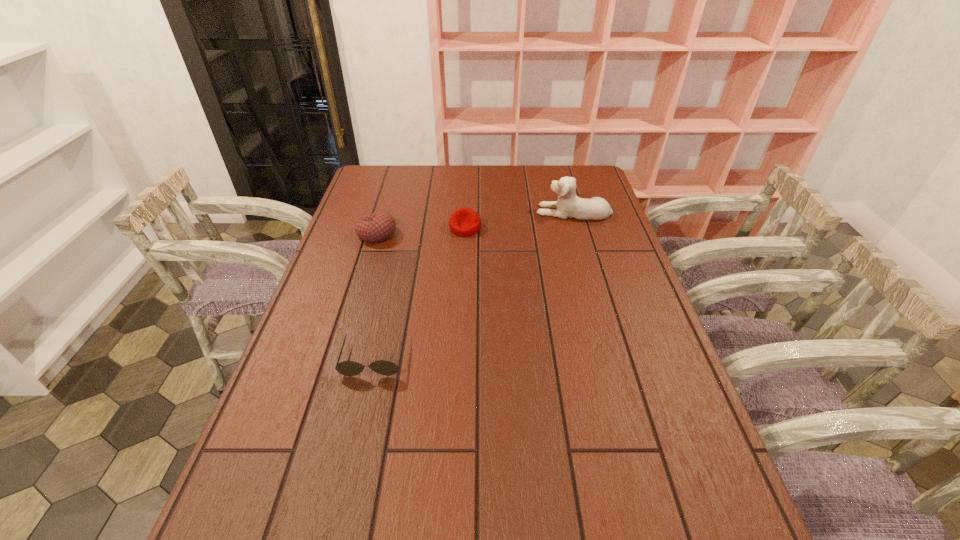
This screenshot has height=540, width=960. I want to click on free space at the far right corner of the desktop, so click(584, 168).

At what (x,y) coordinates should I click in order to perform the action: click on free point between the right beanbag and the left beanbag. Please return your answer as a coordinate pair (x, y). The height and width of the screenshot is (540, 960). Looking at the image, I should click on (421, 231).

What are the coordinates of `blank region between the second object from right to left and the sunglasses` in the screenshot? It's located at (420, 293).

The width and height of the screenshot is (960, 540). Find the location of `vacant space that's between the left beanbag and the right beanbag`. vacant space that's between the left beanbag and the right beanbag is located at coordinates (421, 231).

The height and width of the screenshot is (540, 960). Identify the location of vacant space that is in between the left beanbag and the nearest object. (375, 296).

You are a GUI agent. You are given a task and a screenshot of the screen. Output one action in this format:
    pyautogui.click(x=<x>, y=<y>)
    Task: Click on the free space between the left beanbag and the sunglasses
    The height and width of the screenshot is (540, 960).
    Given the screenshot: What is the action you would take?
    pyautogui.click(x=375, y=296)

Locate an element on the screen. free area in between the second object from right to left and the left beanbag is located at coordinates (421, 231).

You are a GUI agent. You are given a task and a screenshot of the screen. Output one action in this format:
    pyautogui.click(x=<x>, y=<y>)
    Task: Click on the vacant point located between the left beanbag and the sunglasses
    The image size is (960, 540).
    Given the screenshot: What is the action you would take?
    point(375,296)

The height and width of the screenshot is (540, 960). I want to click on free space between the nearest object and the tallest object, so click(x=473, y=285).

Where is `free space between the second object from right to left and the taller beanbag`? This screenshot has height=540, width=960. free space between the second object from right to left and the taller beanbag is located at coordinates (421, 231).